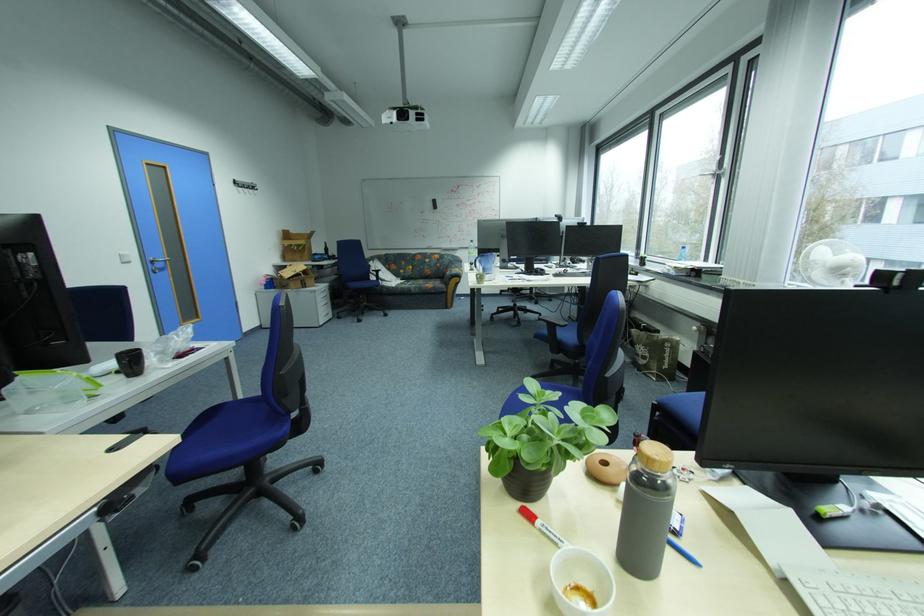
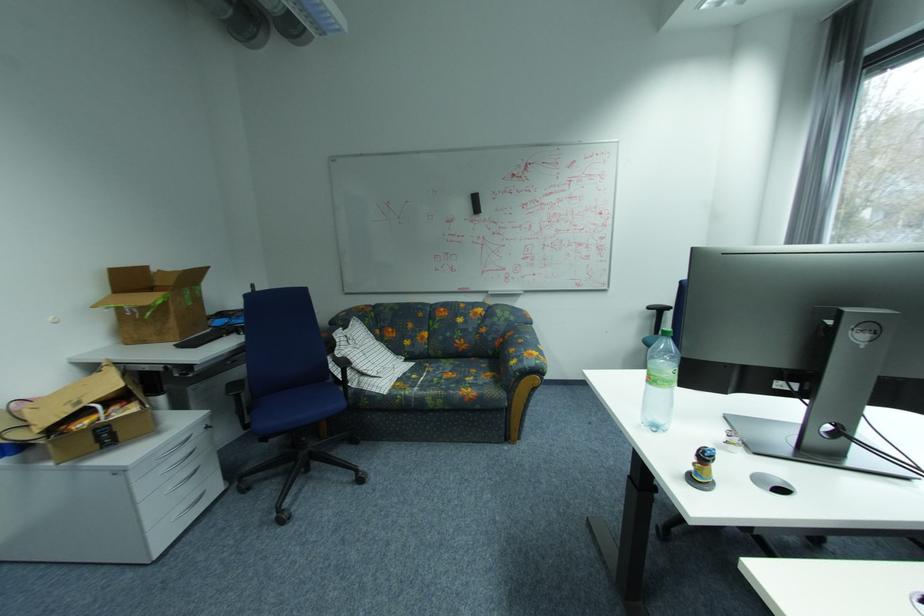
The point at (456,274) is marked in the first image. Where is the corresponding point in the second image?

(521, 363)